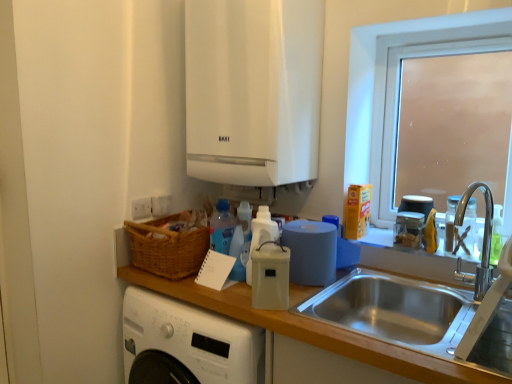
Question: Should I look upward or downward to see clear glass bottle at right, which is counted as the 1th bottle, starting from the right?

Choices:
 (A) up
 (B) down

Answer: (B)

Question: Is blue matte paper towel at right further to camera compared to clear glass bottle at right, which is the second bottle from left to right?

Choices:
 (A) no
 (B) yes

Answer: (A)

Question: Is blue matte paper towel at right far from clear glass bottle at right, which is the second bottle from left to right?

Choices:
 (A) yes
 (B) no

Answer: (B)

Question: Can you see blue matte paper towel at right touching clear glass bottle at right, which is the second bottle from left to right?

Choices:
 (A) no
 (B) yes

Answer: (A)

Question: From a real-world perspective, is blue matte paper towel at right below clear glass bottle at right, which is the second bottle from left to right?

Choices:
 (A) no
 (B) yes

Answer: (B)

Question: Is blue matte paper towel at right in front of clear glass bottle at right, which is the second bottle from left to right?

Choices:
 (A) no
 (B) yes

Answer: (B)

Question: Can you confirm if blue matte paper towel at right is bigger than clear glass bottle at right, which is counted as the 1th bottle, starting from the right?

Choices:
 (A) yes
 (B) no

Answer: (A)

Question: Considering the relative sizes of white plastic bottle at center, which is counted as the first bottle, starting from the left, and translucent glass jar at upper right, marked as the 1th appliance in a back-to-front arrangement, in the image provided, is white plastic bottle at center, which is counted as the first bottle, starting from the left, shorter than translucent glass jar at upper right, marked as the 1th appliance in a back-to-front arrangement,?

Choices:
 (A) yes
 (B) no

Answer: (B)

Question: Is white plastic bottle at center, which is counted as the first bottle, starting from the left, directly adjacent to translucent glass jar at upper right, which is the third appliance from front to back?

Choices:
 (A) yes
 (B) no

Answer: (B)

Question: Is white plastic bottle at center, which is counted as the first bottle, starting from the left, oriented towards translucent glass jar at upper right, arranged as the third appliance when viewed from the left?

Choices:
 (A) yes
 (B) no

Answer: (B)

Question: Is white plastic bottle at center, the second bottle in the right-to-left sequence, bigger than translucent glass jar at upper right, which ranks as the first appliance in right-to-left order?

Choices:
 (A) yes
 (B) no

Answer: (B)

Question: Is translucent glass jar at upper right, arranged as the third appliance when viewed from the left, at the back of white plastic bottle at center, which is counted as the first bottle, starting from the left?

Choices:
 (A) yes
 (B) no

Answer: (B)

Question: From a real-world perspective, is white plastic bottle at center, the second bottle in the right-to-left sequence, physically below translucent glass jar at upper right, which ranks as the first appliance in right-to-left order?

Choices:
 (A) no
 (B) yes

Answer: (B)

Question: From a real-world perspective, is stainless steel sink at lower right below clear plastic container at upper right, the 2th appliance viewed from the front?

Choices:
 (A) no
 (B) yes

Answer: (B)